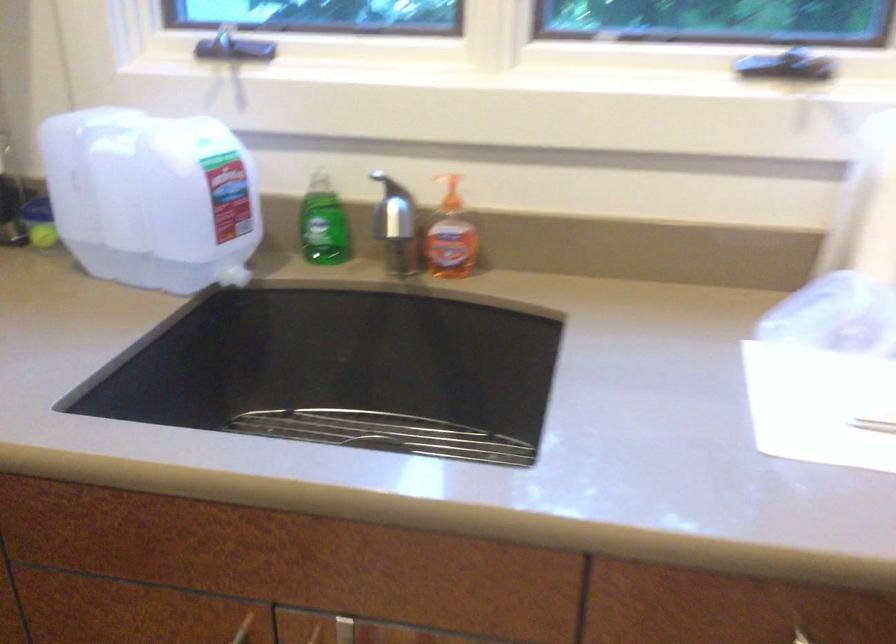
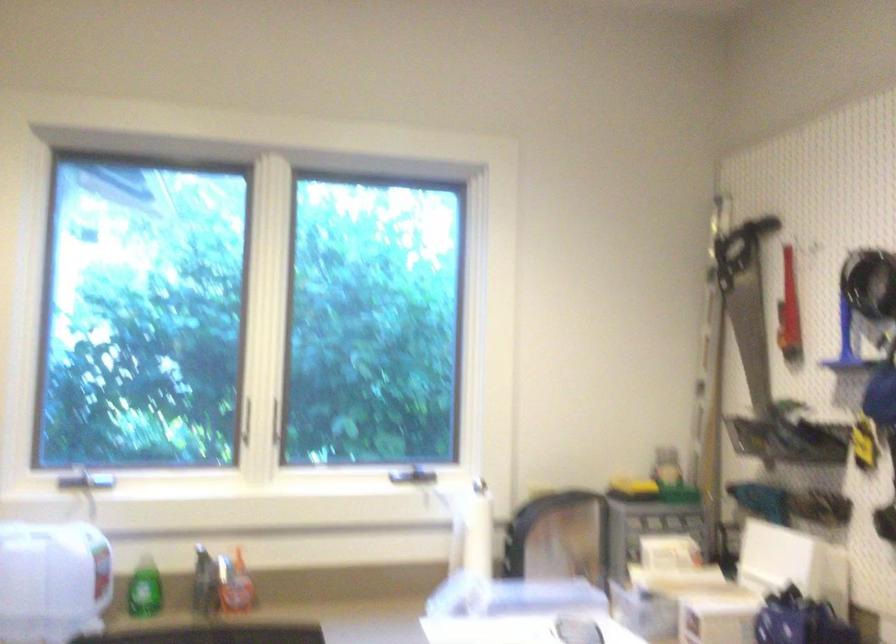
Locate, in the second image, the point that corresponds to (x=789, y=71) in the first image.

(419, 475)